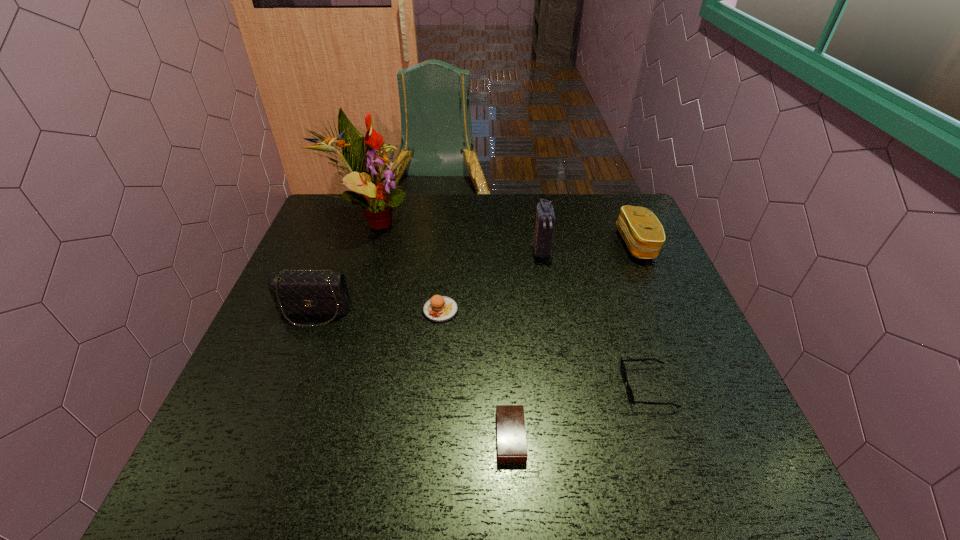
Where is `vacant space located on the front-facing side of the sunglasses`? vacant space located on the front-facing side of the sunglasses is located at coordinates (492, 387).

This screenshot has width=960, height=540. In order to click on free spot located 0.150m on the front-facing side of the sunglasses in this screenshot , I will do `click(554, 387)`.

Locate an element on the screen. This screenshot has height=540, width=960. vacant space situated 0.060m on the front-facing side of the sunglasses is located at coordinates (596, 387).

At what (x,y) coordinates should I click in order to perform the action: click on vacant point located 0.080m on the front face of the fourth object from left to right. Please return your answer as a coordinate pair (x, y). Looking at the image, I should click on (455, 437).

You are a GUI agent. You are given a task and a screenshot of the screen. Output one action in this format:
    pyautogui.click(x=<x>, y=<y>)
    Task: Click on the vacant region located 0.380m on the front face of the fourth object from left to right
    Image resolution: width=960 pixels, height=540 pixels.
    Given the screenshot: What is the action you would take?
    pyautogui.click(x=300, y=437)

Locate an element on the screen. The height and width of the screenshot is (540, 960). free region located on the front face of the fourth object from left to right is located at coordinates (289, 437).

Identify the location of bouquet that is at the far edge. The image size is (960, 540). (363, 157).

Locate an element on the screen. Image resolution: width=960 pixels, height=540 pixels. clutch bag at the far edge is located at coordinates (642, 232).

Identify the location of object at the near edge. Image resolution: width=960 pixels, height=540 pixels. (510, 424).

The image size is (960, 540). I want to click on bouquet located in the left edge section of the desktop, so click(363, 157).